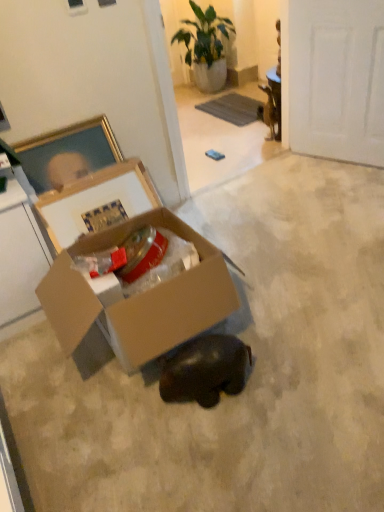
The width and height of the screenshot is (384, 512). I want to click on vacant space in between cardboard box at center and shiny black elephant at center, so click(x=164, y=407).